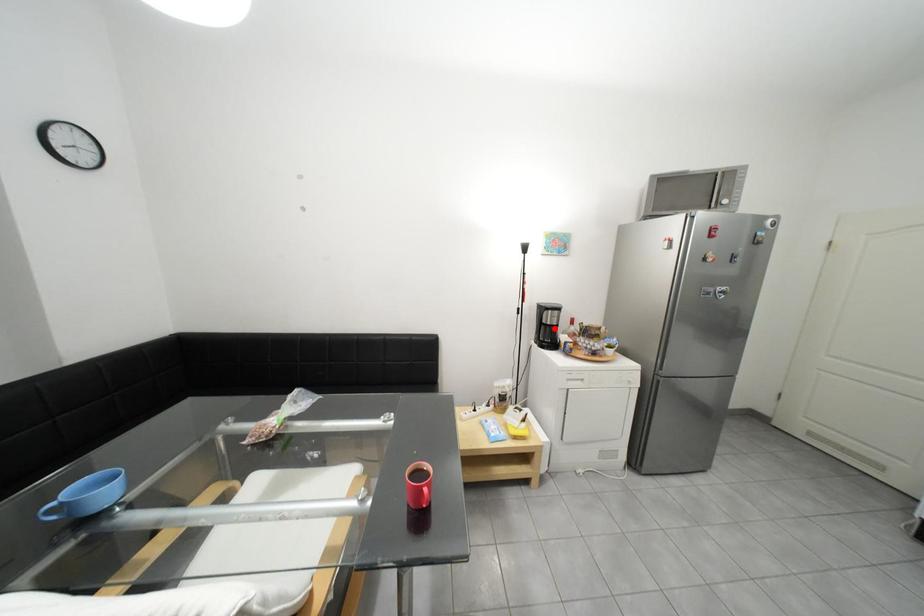
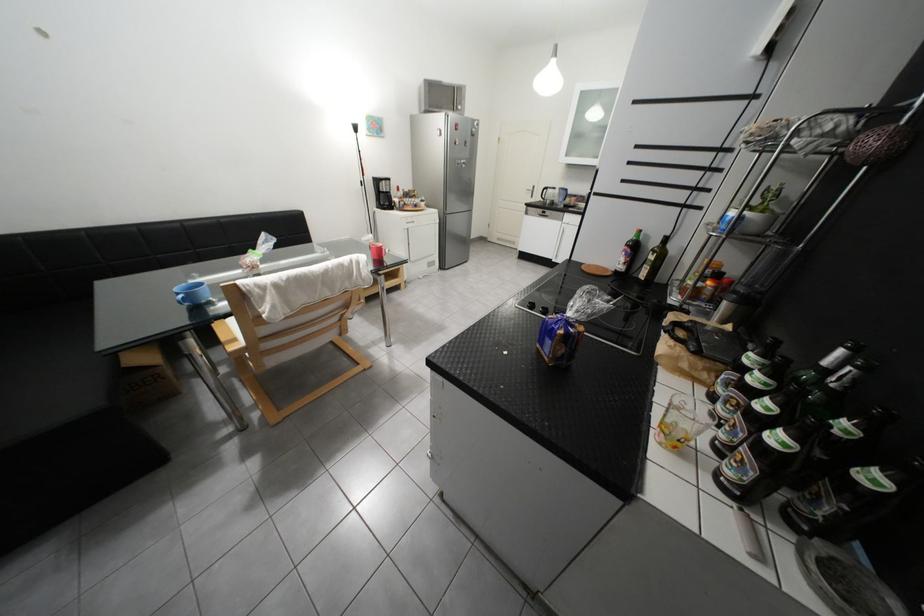
Find the pixel in the second image that matches the highlighted location in the first image.

(393, 196)